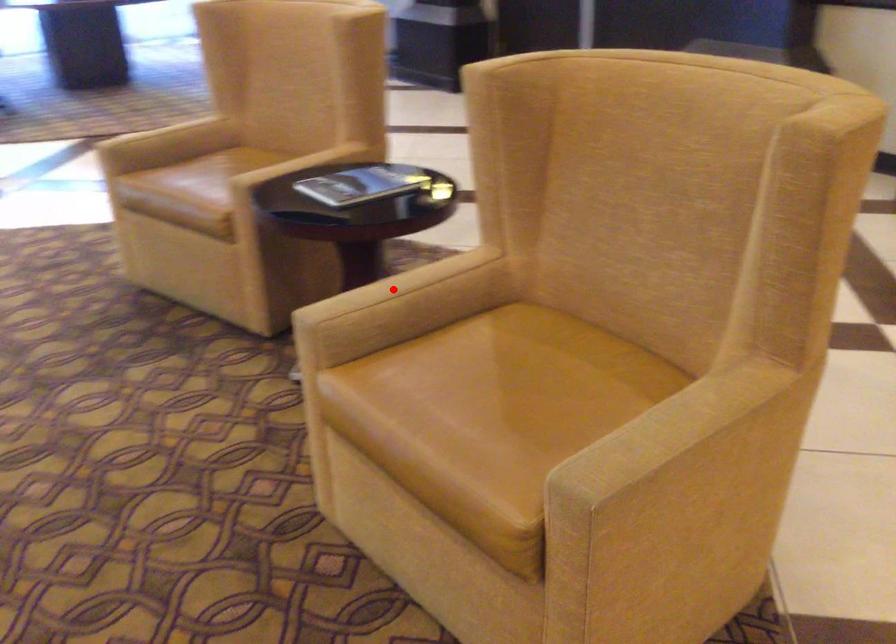
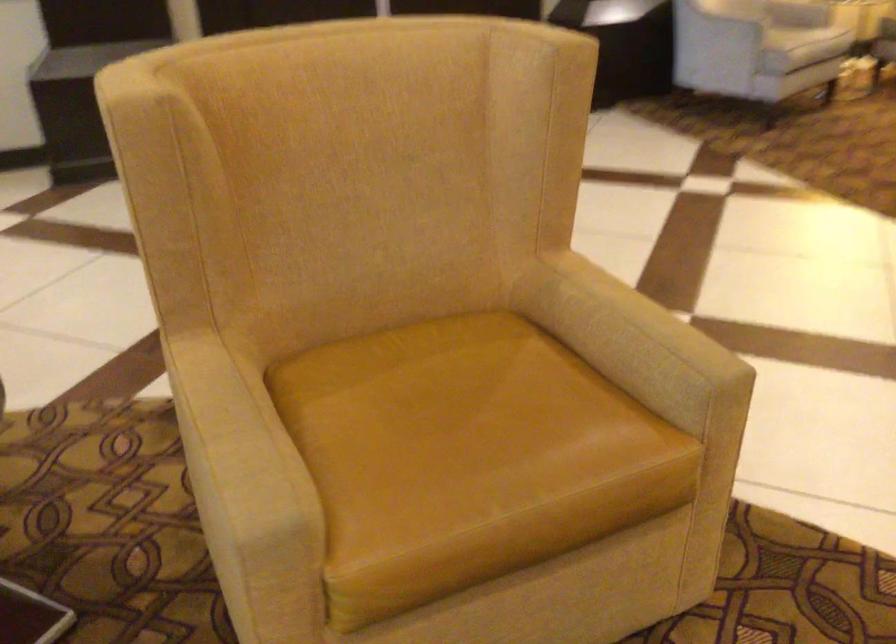
Question: I am providing you with two images of the same scene from different viewpoints. A red point is shown in image1. For the corresponding object point in image2, is it positioned nearer or farther from the camera?

Choices:
 (A) Nearer
 (B) Farther

Answer: (A)